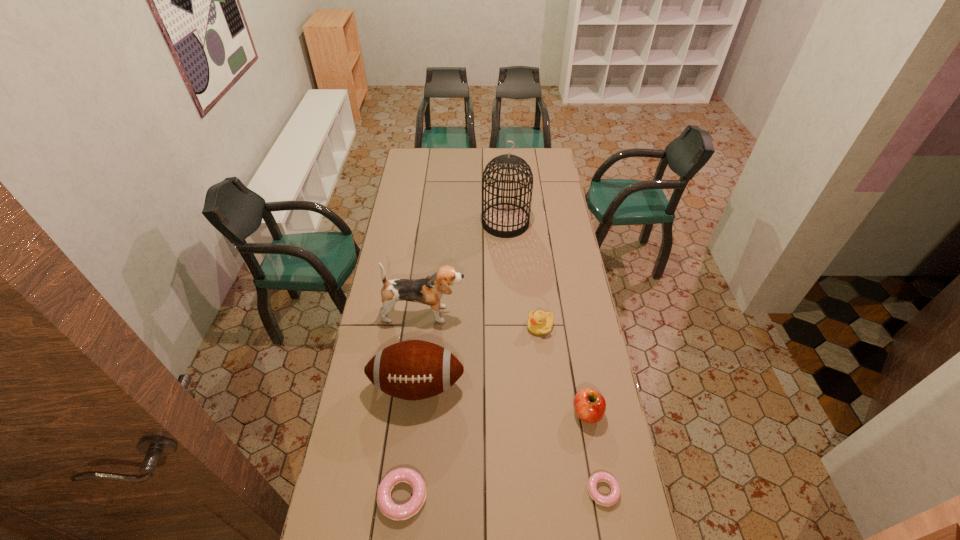
You are a GUI agent. You are given a task and a screenshot of the screen. Output one action in this format:
    pyautogui.click(x=<x>, y=<y>)
    Task: Click on the puppy present at the left edge
    The image size is (960, 540).
    Given the screenshot: What is the action you would take?
    pyautogui.click(x=429, y=290)

Where is `football present at the left edge`? This screenshot has width=960, height=540. football present at the left edge is located at coordinates (412, 370).

Locate an element on the screen. This screenshot has height=540, width=960. doughnut that is at the right edge is located at coordinates (614, 496).

Locate an element on the screen. duckling that is positioned at the right edge is located at coordinates (539, 323).

This screenshot has width=960, height=540. Identify the location of apple at the right edge. (589, 405).

Image resolution: width=960 pixels, height=540 pixels. I want to click on object that is at the near left corner, so click(x=391, y=510).

You are a GUI agent. You are given a task and a screenshot of the screen. Output one action in this format:
    pyautogui.click(x=<x>, y=<y>)
    Task: Click on the object located in the near right corner section of the desktop
    Image resolution: width=960 pixels, height=540 pixels.
    Given the screenshot: What is the action you would take?
    pyautogui.click(x=614, y=496)

This screenshot has height=540, width=960. In the image, there is a desktop. In order to click on vacant region at the far edge in this screenshot , I will do `click(463, 155)`.

Image resolution: width=960 pixels, height=540 pixels. In the image, there is a desktop. In order to click on free region at the near edge in this screenshot , I will do `click(432, 515)`.

Locate an element on the screen. The width and height of the screenshot is (960, 540). free space at the left edge of the desktop is located at coordinates (360, 406).